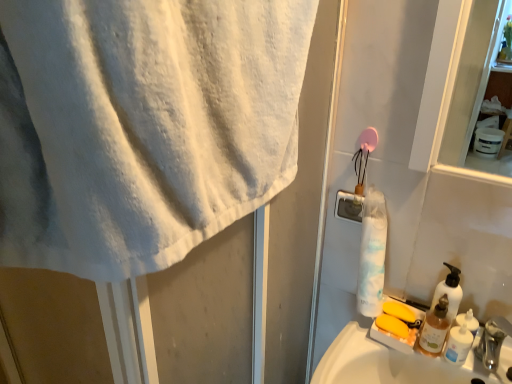
Question: Looking at their shapes, would you say translucent plastic soap dispenser at right is wider or thinner than white matte shaving cream at lower right?

Choices:
 (A) wide
 (B) thin

Answer: (A)

Question: Based on their sizes in the image, would you say translucent plastic soap dispenser at right is bigger or smaller than white matte shaving cream at lower right?

Choices:
 (A) big
 (B) small

Answer: (A)

Question: Which is nearer to the translucent plastic soap dispenser at right?

Choices:
 (A) white cotton towel at upper left
 (B) silver metallic faucet at lower right
 (C) white matte soap dispenser at right
 (D) white matte shaving cream at lower right

Answer: (C)

Question: Considering the real-world distances, which object is farthest from the silver metallic faucet at lower right?

Choices:
 (A) white matte shaving cream at lower right
 (B) white matte soap dispenser at right
 (C) white cotton towel at upper left
 (D) translucent plastic soap dispenser at right

Answer: (C)